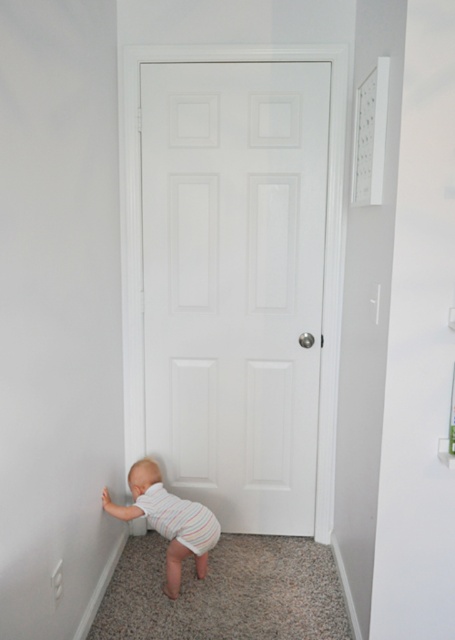
Question: Which object is the farthest from the striped cotton onesie at lower left?

Choices:
 (A) white matte door at center
 (B) striped cotton diaper at lower left

Answer: (A)

Question: Is striped cotton onesie at lower left thinner than striped cotton diaper at lower left?

Choices:
 (A) no
 (B) yes

Answer: (A)

Question: Which point is closer to the camera?

Choices:
 (A) white matte door at center
 (B) striped cotton diaper at lower left

Answer: (B)

Question: Can you confirm if striped cotton onesie at lower left is bigger than striped cotton diaper at lower left?

Choices:
 (A) yes
 (B) no

Answer: (A)

Question: Is white matte door at center below striped cotton diaper at lower left?

Choices:
 (A) yes
 (B) no

Answer: (B)

Question: Which point is closer to the camera?

Choices:
 (A) (156, 525)
 (B) (236, 356)
 (C) (143, 460)

Answer: (A)